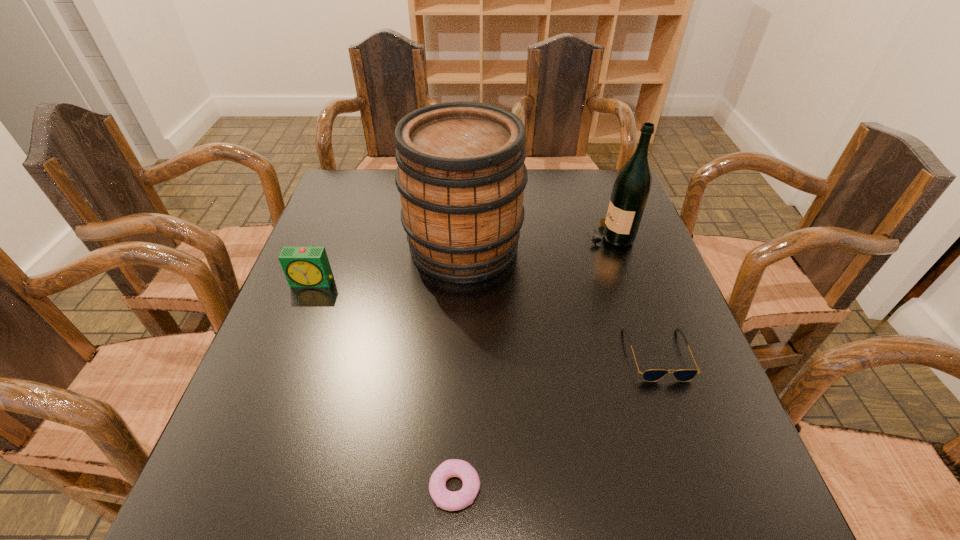
This screenshot has width=960, height=540. I want to click on free spot located on the front-facing side of the third shortest object, so click(x=297, y=323).

The image size is (960, 540). What are the coordinates of `free space located 0.260m on the front-facing side of the fourth tallest object` in the screenshot? It's located at (717, 524).

Find the location of `free space located on the back of the doughnut`. free space located on the back of the doughnut is located at coordinates (463, 296).

Identify the location of object at the near edge. (448, 500).

Find the location of a particular element. object at the left edge is located at coordinates (304, 267).

You are a GUI agent. You are given a task and a screenshot of the screen. Output one action in this format:
    pyautogui.click(x=<x>, y=<y>)
    Task: Click on the wine bottle that is positioned at the right edge
    
    Given the screenshot: What is the action you would take?
    [x=631, y=189]

The width and height of the screenshot is (960, 540). I want to click on sunglasses at the right edge, so click(x=652, y=375).

Where is `free region at the far edge of the desktop`? The height and width of the screenshot is (540, 960). free region at the far edge of the desktop is located at coordinates (550, 172).

In the image, there is a desktop. Where is `vacant space at the near edge`? The image size is (960, 540). vacant space at the near edge is located at coordinates coord(569,485).

Locate an element on the screen. Image resolution: width=960 pixels, height=540 pixels. free space at the left edge of the desktop is located at coordinates (346, 252).